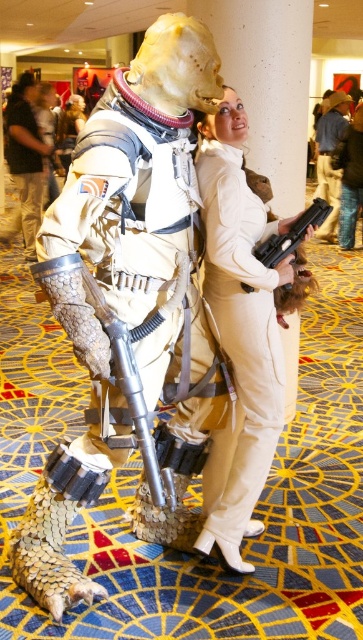
Based on the photo, you are organizing a cosplay photo shoot and need to ensure that all props and costumes fit within a 1.5 meter wide backdrop. Given that the denim jacket at upper center and the black plastic gun at center are part of the setup, can both items fit side by side on the backdrop without overlapping?

The denim jacket at upper center is wider than the black plastic gun at center. However, since the total width of both items combined must be less than 1.5 meters to fit side by side, we need to know their exact dimensions. The description only states the jacket is wider than the gun but doesn

You are a photographer at the event and need to capture a clear shot of both the metallic armor at center and the black plastic gun at center. Since you want to focus on the armor first, which object should you adjust your camera focus on first?

The metallic armor at center is closer to the viewer than the black plastic gun at center, so you should focus on the metallic armor at center first to ensure it is in sharp focus before adjusting for the gun.